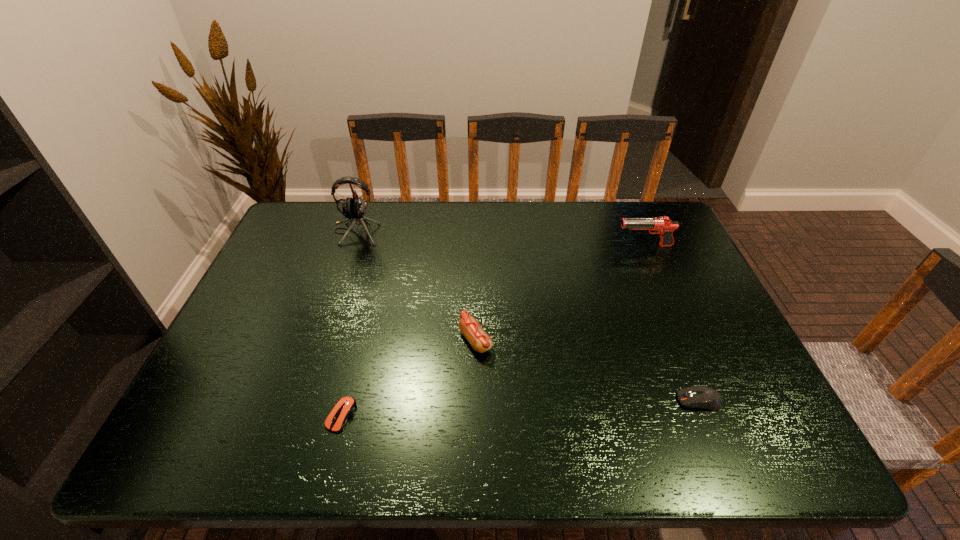
This screenshot has height=540, width=960. What are the coordinates of `object that is the second closest one to the third shortest object` in the screenshot? It's located at (354, 209).

At what (x,y) coordinates should I click in order to perform the action: click on object that is the fourth nearest to the shortest object. Please return your answer as a coordinate pair (x, y). Looking at the image, I should click on (663, 226).

This screenshot has width=960, height=540. I want to click on free space that satisfies the following two spatial constraints: 1. on the front side of the third farthest object; 2. on the right side of the earphone, so click(320, 340).